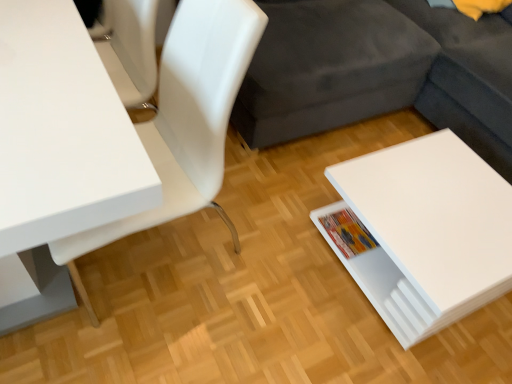
Question: Does white glossy table at lower right, marked as the 2th table in a left-to-right arrangement, have a greater height compared to multicolored paper book at lower right?

Choices:
 (A) yes
 (B) no

Answer: (A)

Question: Is white glossy table at lower right, the first table from the right, directly adjacent to multicolored paper book at lower right?

Choices:
 (A) yes
 (B) no

Answer: (B)

Question: From a real-world perspective, is white glossy table at lower right, marked as the 2th table in a left-to-right arrangement, on top of multicolored paper book at lower right?

Choices:
 (A) no
 (B) yes

Answer: (B)

Question: From the image's perspective, is white glossy table at lower right, marked as the 2th table in a left-to-right arrangement, below multicolored paper book at lower right?

Choices:
 (A) no
 (B) yes

Answer: (B)

Question: Is white glossy table at lower right, the first table from the right, aimed at multicolored paper book at lower right?

Choices:
 (A) no
 (B) yes

Answer: (A)

Question: Relative to white glossy table at lower right, the first table from the right, is white glossy chair at upper left in front or behind?

Choices:
 (A) behind
 (B) front

Answer: (B)

Question: In terms of width, does white glossy chair at upper left look wider or thinner when compared to white glossy table at lower right, the first table from the right?

Choices:
 (A) thin
 (B) wide

Answer: (B)

Question: Do you think white glossy chair at upper left is within white glossy table at lower right, the first table from the right, or outside of it?

Choices:
 (A) outside
 (B) inside

Answer: (A)

Question: Considering the positions of white glossy chair at upper left and white glossy table at lower right, marked as the 2th table in a left-to-right arrangement, in the image, is white glossy chair at upper left taller or shorter than white glossy table at lower right, marked as the 2th table in a left-to-right arrangement,?

Choices:
 (A) short
 (B) tall

Answer: (B)

Question: From the image's perspective, is white glossy chair at upper left positioned above or below multicolored paper book at lower right?

Choices:
 (A) above
 (B) below

Answer: (A)

Question: Is white glossy chair at upper left inside or outside of multicolored paper book at lower right?

Choices:
 (A) outside
 (B) inside

Answer: (A)

Question: From a real-world perspective, is white glossy chair at upper left above or below multicolored paper book at lower right?

Choices:
 (A) below
 (B) above

Answer: (B)

Question: From their relative heights in the image, would you say white glossy chair at upper left is taller or shorter than multicolored paper book at lower right?

Choices:
 (A) tall
 (B) short

Answer: (A)

Question: From their relative heights in the image, would you say white glossy table at left, placed as the second table when sorted from right to left, is taller or shorter than white glossy chair at upper left?

Choices:
 (A) short
 (B) tall

Answer: (A)

Question: In the image, is white glossy table at left, placed as the second table when sorted from right to left, positioned in front of or behind white glossy chair at upper left?

Choices:
 (A) behind
 (B) front

Answer: (B)